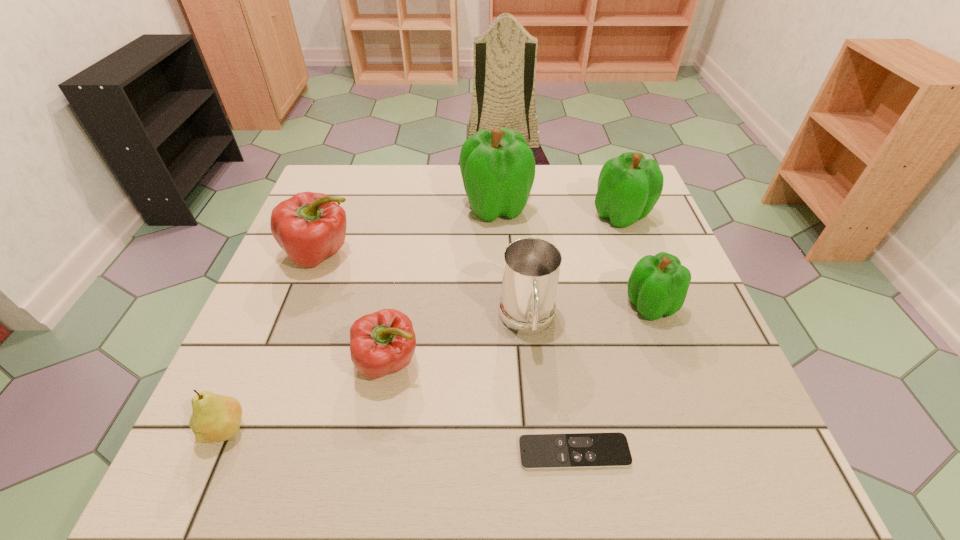
The image size is (960, 540). What are the coordinates of `empty space between the farther pink bell pepper and the mug` in the screenshot? It's located at (424, 288).

This screenshot has height=540, width=960. Identify the location of empty location between the mug and the fourth farthest bell pepper. (588, 314).

Select which object is the second closest to the third bell pepper from right to left. Please provide its 2D coordinates. Your answer should be formatted as a tuple, i.e. [(x, y)], where the tuple contains the x and y coordinates of a point satisfying the conditions above.

[(531, 266)]

Choose which object is the fifth nearest neighbor to the shortest object. Please provide its 2D coordinates. Your answer should be formatted as a tuple, i.e. [(x, y)], where the tuple contains the x and y coordinates of a point satisfying the conditions above.

[(310, 227)]

I want to click on bell pepper that is the fourth closest to the biggest green bell pepper, so click(x=381, y=343).

Locate an element on the screen. bell pepper that can be found as the second closest to the pear is located at coordinates (310, 227).

At what (x,y) coordinates should I click in order to perform the action: click on the third closest green bell pepper relative to the leftmost bell pepper. Please return your answer as a coordinate pair (x, y). This screenshot has height=540, width=960. Looking at the image, I should click on (658, 285).

Identify which green bell pepper is located as the nearest to the second nearest bell pepper. Please provide its 2D coordinates. Your answer should be formatted as a tuple, i.e. [(x, y)], where the tuple contains the x and y coordinates of a point satisfying the conditions above.

[(629, 186)]

The width and height of the screenshot is (960, 540). Find the location of `vacant region that satisfies the following two spatial constraints: 1. on the back side of the second smallest green bell pepper; 2. on the left side of the remote control`. vacant region that satisfies the following two spatial constraints: 1. on the back side of the second smallest green bell pepper; 2. on the left side of the remote control is located at coordinates (538, 215).

Find the location of a particular element. free location that satisfies the following two spatial constraints: 1. on the front side of the second smallest green bell pepper; 2. on the left side of the tallest bell pepper is located at coordinates (496, 215).